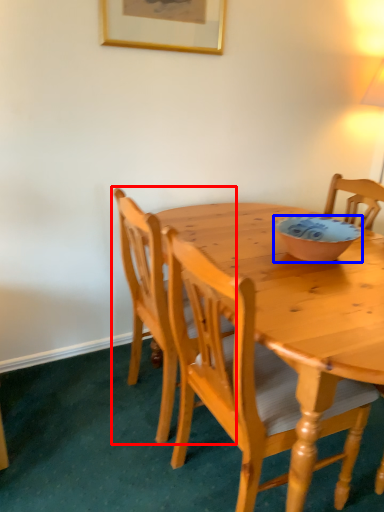
Question: Which of the following is the closest to the observer, chair (highlighted by a red box) or bowl (highlighted by a blue box)?

Choices:
 (A) chair
 (B) bowl

Answer: (A)